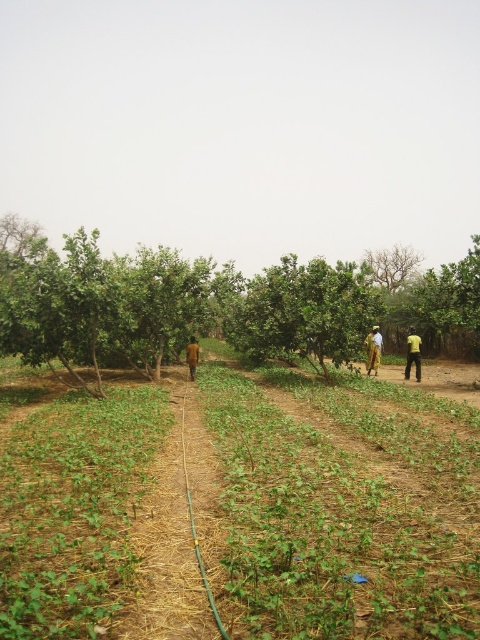
Is point (384, 280) farther from camera compared to point (416, 333)?

Yes, point (384, 280) is farther from viewer.

Which is behind, point (398, 257) or point (408, 369)?

The point (398, 257) is more distant.

At what (x,y) coordinates should I click in order to perform the action: click on green leafy tree at upper center. Please return your answer as a coordinate pair (x, y). Looking at the image, I should click on (391, 266).

Identify the location of green leafy tree at upper center. Image resolution: width=480 pixels, height=640 pixels. (391, 266).

Which is below, green leafy tree at upper center or yellow fabric dress at right?

yellow fabric dress at right is lower down.

Is green leafy tree at upper center below yellow fabric dress at right?

No, green leafy tree at upper center is not below yellow fabric dress at right.

Does point (387, 248) come farther from viewer compared to point (372, 340)?

Yes, point (387, 248) is farther from viewer.

Find the location of `green leafy tree at upper center`. green leafy tree at upper center is located at coordinates (391, 266).

Who is positioned more to the right, yellow fabric dress at right or brown textured person at center?

From the viewer's perspective, yellow fabric dress at right appears more on the right side.

Between yellow fabric dress at right and brown textured person at center, which one has more height?

Standing taller between the two is yellow fabric dress at right.

Identify the location of yellow fabric dress at right. This screenshot has height=640, width=480. (372, 349).

The height and width of the screenshot is (640, 480). Find the location of `yellow fabric dress at right`. yellow fabric dress at right is located at coordinates (372, 349).